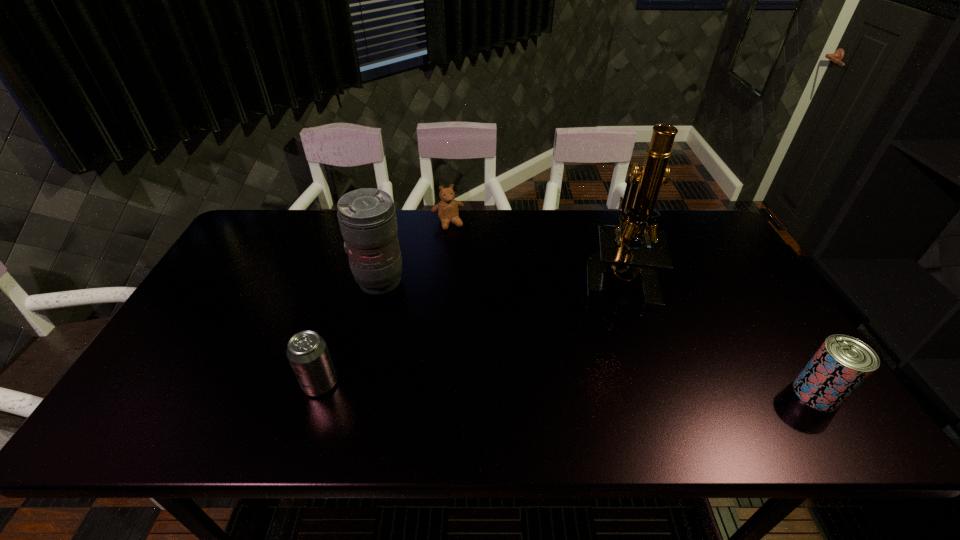
Identify the location of the left beer can. The width and height of the screenshot is (960, 540). (307, 352).

Where is `the rightmost object`? Image resolution: width=960 pixels, height=540 pixels. the rightmost object is located at coordinates (841, 365).

Find the location of a particular element. The height and width of the screenshot is (540, 960). the fourth object from left to right is located at coordinates (616, 254).

Image resolution: width=960 pixels, height=540 pixels. What are the coordinates of `the tallest object` in the screenshot? It's located at (616, 254).

At what (x,y) coordinates should I click in order to perform the action: click on the fourth shortest object. Please return your answer as a coordinate pair (x, y). The width and height of the screenshot is (960, 540). Looking at the image, I should click on (367, 217).

This screenshot has height=540, width=960. In order to click on teddy bear in this screenshot , I will do `click(447, 209)`.

This screenshot has width=960, height=540. I want to click on the third object from left to right, so click(x=447, y=209).

Where is `vacant space situated 0.380m on the left of the left beer can`? vacant space situated 0.380m on the left of the left beer can is located at coordinates (141, 384).

Where is `free space located on the left of the rightmost object`? This screenshot has width=960, height=540. free space located on the left of the rightmost object is located at coordinates (752, 394).

Image resolution: width=960 pixels, height=540 pixels. I want to click on vacant area situated 0.150m at the eyepiece of the microscope, so click(584, 341).